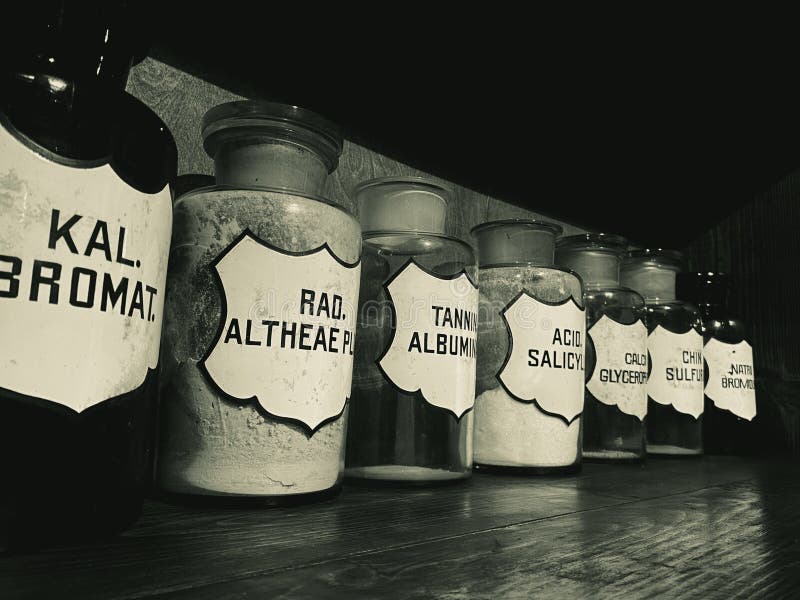
Locate an element on the screen. back of cupboard is located at coordinates (176, 111).